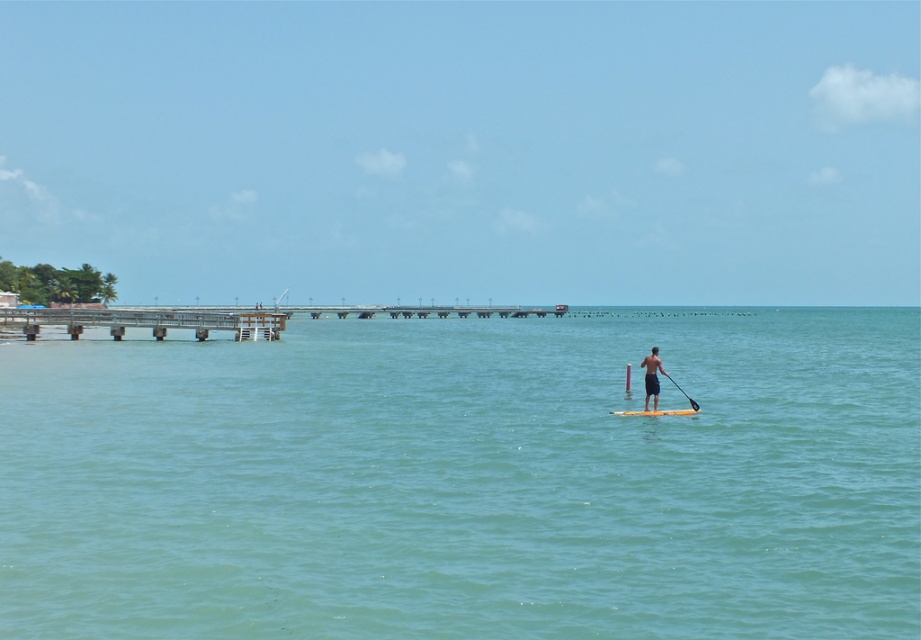
You are standing on the wooden pier and want to take a photo of the yellow foam board at center. Your camera has a focal length of 50mm and you want to fill the frame with the board. The recommended distance for this setup is 30 meters. Do you need to move closer or farther away?

The yellow foam board at center is currently 29.25 meters away from the camera. Since the recommended distance is 30 meters, you need to move slightly farther away to reach the optimal distance for filling the frame.

You are a lifeguard on duty at the beach and need to assess the safety of the tan skin paddleboarder at center and the yellow foam board at center. Based on the distance between them, can you determine if the paddleboarder is properly positioned on the board?

The distance between the tan skin paddleboarder at center and the yellow foam board at center is 17.09 inches, which indicates that the paddleboarder is not positioned correctly on the board since there is a significant gap between them.